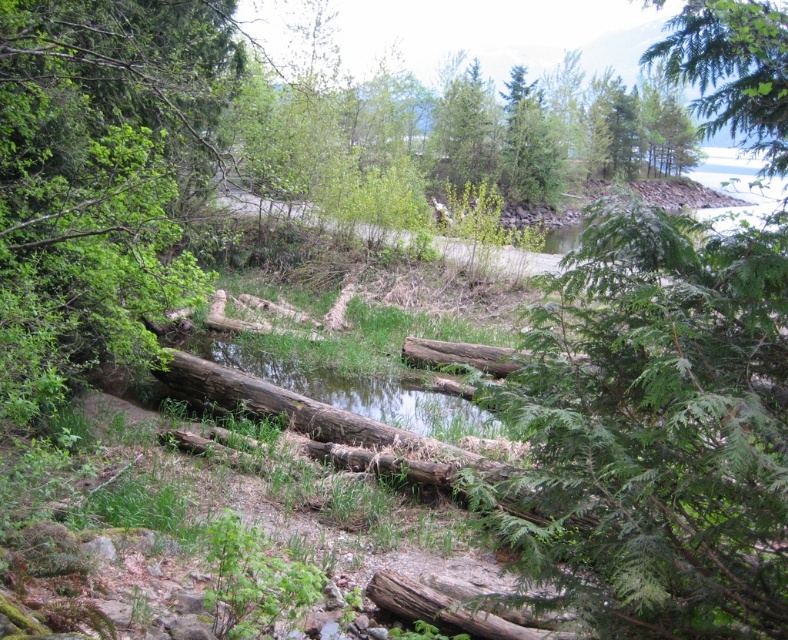
Question: Does brown rough log at left appear under green leafy tree at upper right?

Choices:
 (A) no
 (B) yes

Answer: (B)

Question: Is brown rough log at left below green leafy tree at upper right?

Choices:
 (A) yes
 (B) no

Answer: (A)

Question: Which point is closer to the camera?

Choices:
 (A) (88, 276)
 (B) (768, 163)

Answer: (B)

Question: Which point is closer to the camera taking this photo?

Choices:
 (A) (701, 22)
 (B) (123, 16)

Answer: (A)

Question: Can you confirm if brown rough log at left is positioned to the right of green leafy tree at upper right?

Choices:
 (A) no
 (B) yes

Answer: (A)